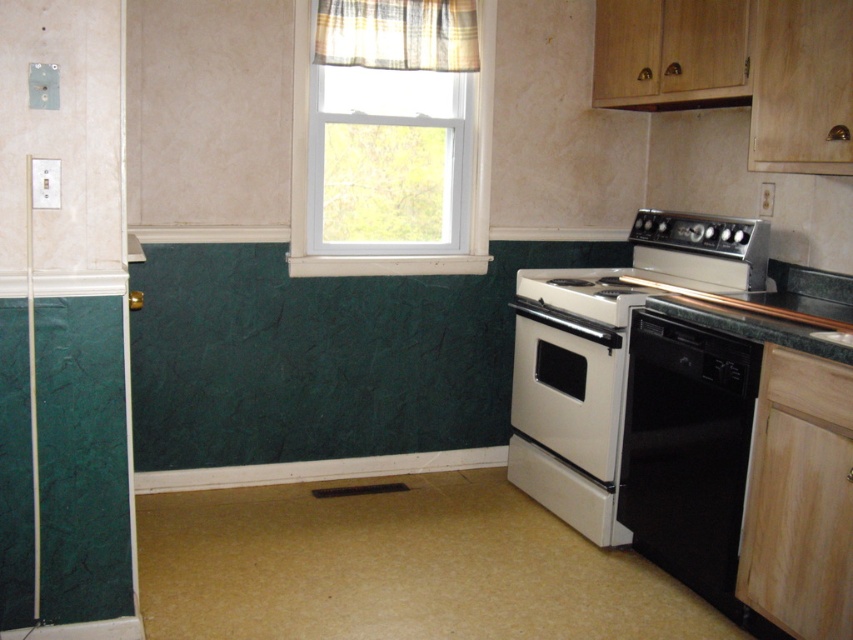
You are standing in the kitchen corner described. There is a point marked at coordinates (605, 358). What object is located at this point?

The point at coordinates (605, 358) marks the white glossy stove at right.

You are a chef preparing to place a large pot on the white glossy stove at right and the green marble countertop at right. Which surface can accommodate the pot based on their sizes?

The white glossy stove at right has a larger size compared to the green marble countertop at right, so the large pot can be placed on the white glossy stove at right.